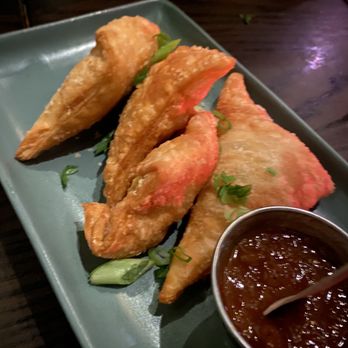
You are a GUI agent. You are given a task and a screenshot of the screen. Output one action in this format:
    pyautogui.click(x=<x>, y=<y>)
    Task: Click on the plate
    This screenshot has width=348, height=348.
    Given the screenshot: What is the action you would take?
    pyautogui.click(x=58, y=236)